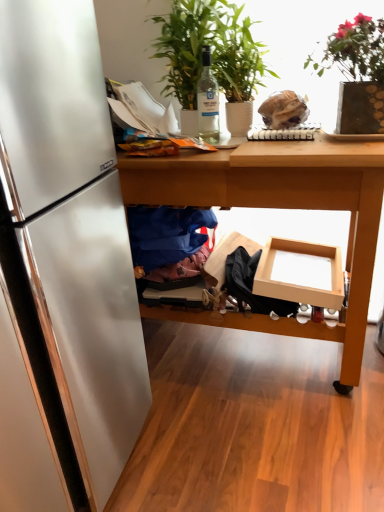
Question: Would you say green leafy plant at upper right, which is the 1th houseplant from right to left, is to the left or to the right of wooden table at center in the picture?

Choices:
 (A) left
 (B) right

Answer: (B)

Question: Choose the correct answer: Is green leafy plant at upper right, positioned as the second houseplant in left-to-right order, inside wooden table at center or outside it?

Choices:
 (A) outside
 (B) inside

Answer: (A)

Question: Which of these objects is positioned closest to the clear glass bottle at center?

Choices:
 (A) green leafy plant at upper center, placed as the first houseplant when sorted from left to right
 (B) green leafy plant at upper right, which is the 1th houseplant from right to left
 (C) matte cardboard box at center
 (D) blue fabric at lower center
 (E) wooden table at center

Answer: (A)

Question: Considering the real-world distances, which object is farthest from the matte cardboard box at center?

Choices:
 (A) blue fabric at lower center
 (B) clear glass bottle at center
 (C) wooden table at center
 (D) green leafy plant at upper right, which is the 1th houseplant from right to left
 (E) green leafy plant at upper center, the second houseplant positioned from the right

Answer: (E)